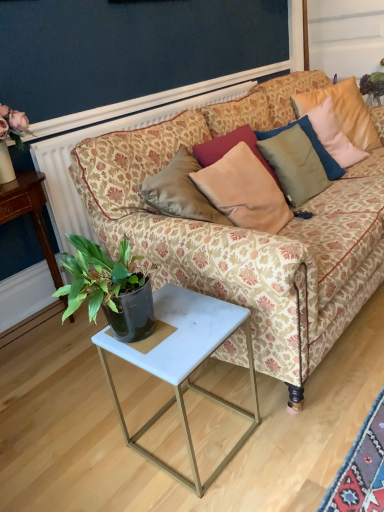
Question: Would you say velvet beige pillow at upper right, arranged as the third pillow when viewed from the left, is to the left or to the right of white marble side table at lower center in the picture?

Choices:
 (A) right
 (B) left

Answer: (A)

Question: Is velvet beige pillow at upper right, placed as the first pillow when sorted from right to left, taller or shorter than white marble side table at lower center?

Choices:
 (A) tall
 (B) short

Answer: (A)

Question: Considering the real-world distances, which object is farthest from the satin beige pillow at upper center, the 2th pillow viewed from the right?

Choices:
 (A) white marble side table at lower center
 (B) satin beige pillow at center, the 3th pillow viewed from the right
 (C) white marble table at lower left
 (D) patterned fabric couch at center
 (E) dark blue wall at upper center

Answer: (C)

Question: Which is farther from the satin beige pillow at upper center, marked as the 2th pillow in a left-to-right arrangement?

Choices:
 (A) green leafy plant at upper right
 (B) velvet beige pillow at upper right, placed as the first pillow when sorted from right to left
 (C) patterned fabric couch at center
 (D) white marble side table at lower center
 (E) white marble table at lower left

Answer: (E)